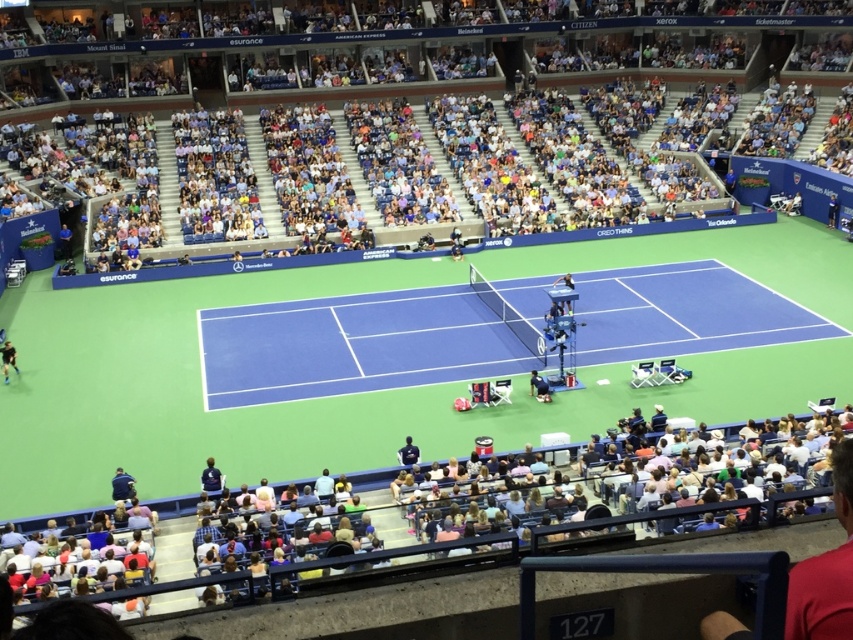
Between black fabric person at lower left and dark blue fabric chair at center, which one appears on the left side from the viewer's perspective?

From the viewer's perspective, black fabric person at lower left appears more on the left side.

This screenshot has height=640, width=853. Describe the element at coordinates (7, 358) in the screenshot. I see `black fabric person at lower left` at that location.

This screenshot has width=853, height=640. In order to click on black fabric person at lower left in this screenshot , I will do [x=7, y=358].

Who is positioned more to the right, blue synthetic turf tennis court at center or black fabric person at lower left?

Positioned to the right is blue synthetic turf tennis court at center.

Does point (405, 296) lie behind point (16, 369)?

Yes, it is.

Which is behind, point (676, 314) or point (3, 346)?

Point (676, 314)

I want to click on blue synthetic turf tennis court at center, so click(352, 346).

Which is above, blue fabric seats at upper center or dark blue fabric chair at center?

blue fabric seats at upper center

You are a GUI agent. You are given a task and a screenshot of the screen. Output one action in this format:
    pyautogui.click(x=<x>, y=<y>)
    Task: Click on the blue fabric seats at upper center
    This screenshot has height=640, width=853.
    Given the screenshot: What is the action you would take?
    pyautogui.click(x=456, y=44)

The height and width of the screenshot is (640, 853). What are the coordinates of `blue fabric seats at upper center` in the screenshot? It's located at (456, 44).